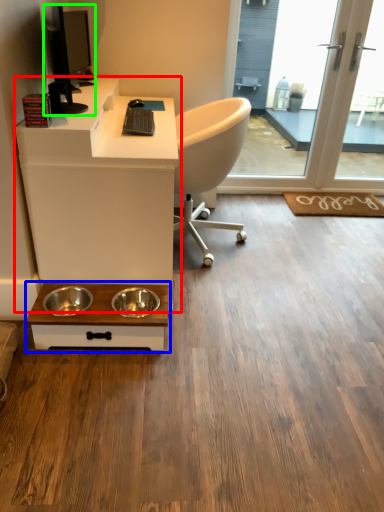
Question: Which object is positioned closest to desk (highlighted by a red box)? Select from table (highlighted by a blue box) and computer monitor (highlighted by a green box).

Choices:
 (A) table
 (B) computer monitor

Answer: (A)